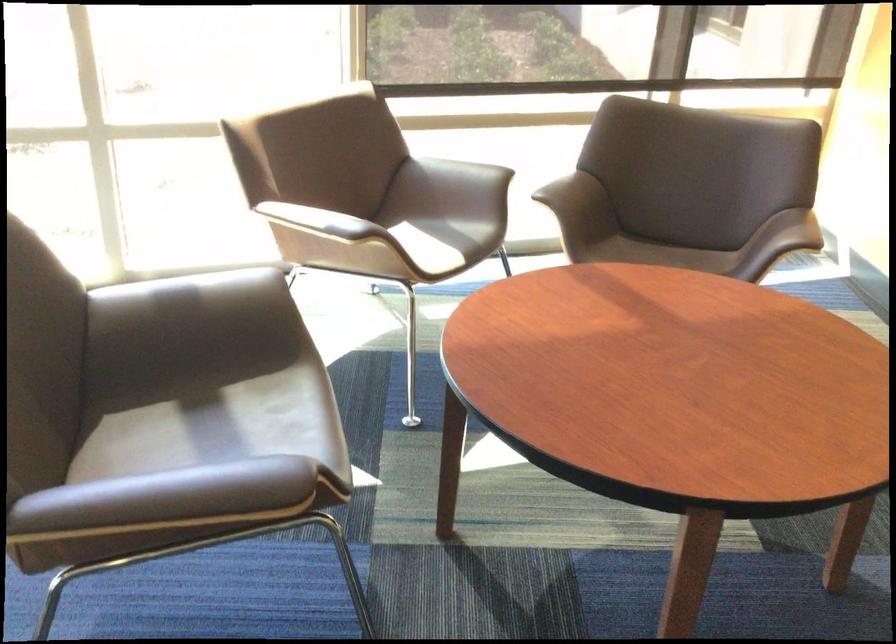
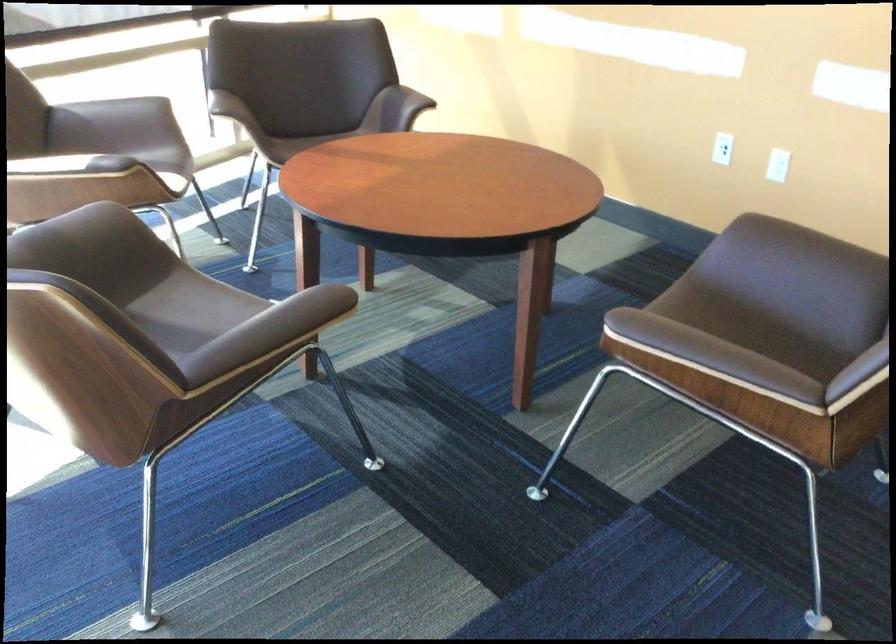
Locate, in the second image, the point that corresponds to (x=280, y=408) in the first image.

(191, 310)